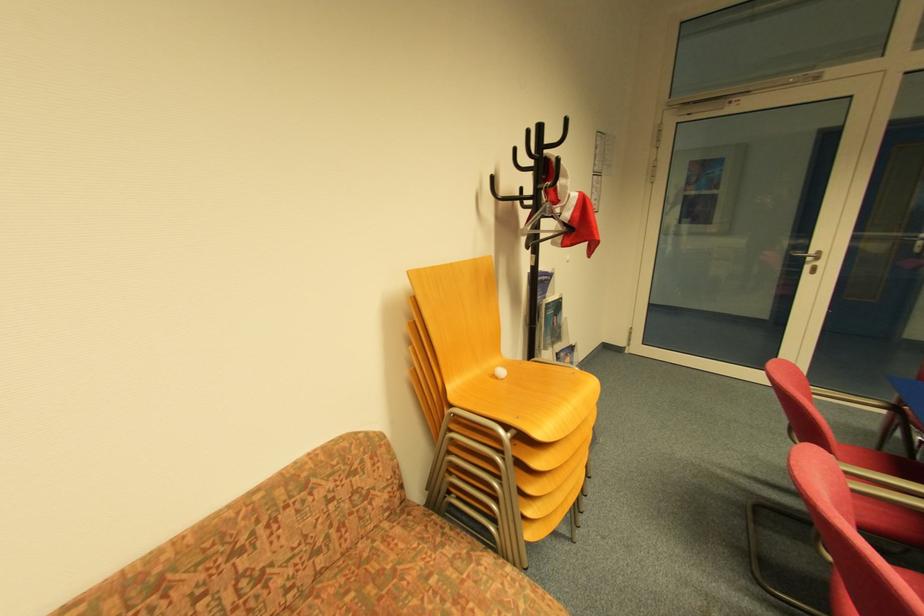
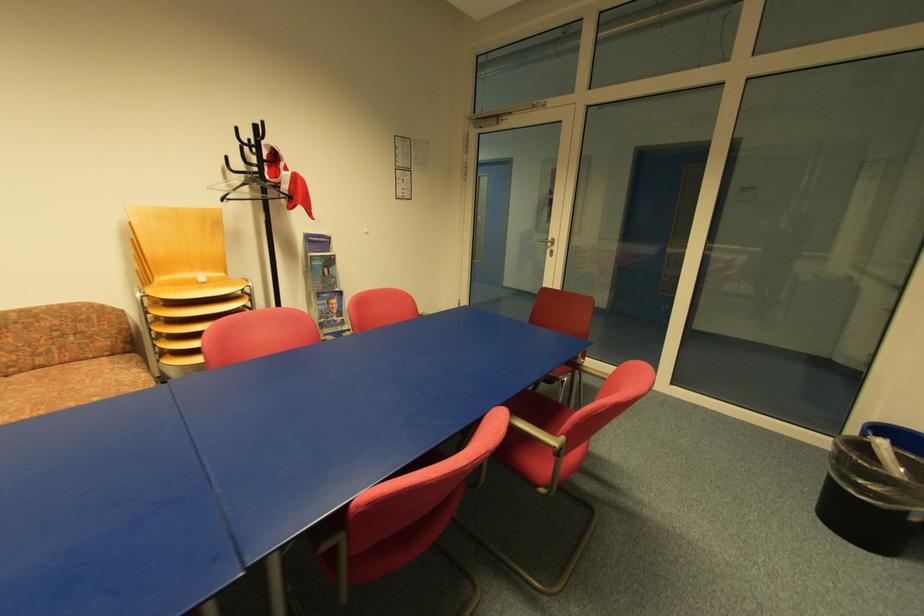
The point at (560, 325) is marked in the first image. Where is the corresponding point in the second image?

(331, 275)